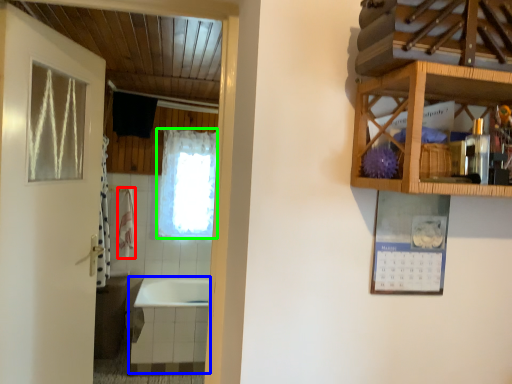
Question: Estimate the real-world distances between objects in this image. Which object is farther from towel/napkin (highlighted by a red box), bath (highlighted by a blue box) or curtain (highlighted by a green box)?

Choices:
 (A) bath
 (B) curtain

Answer: (A)